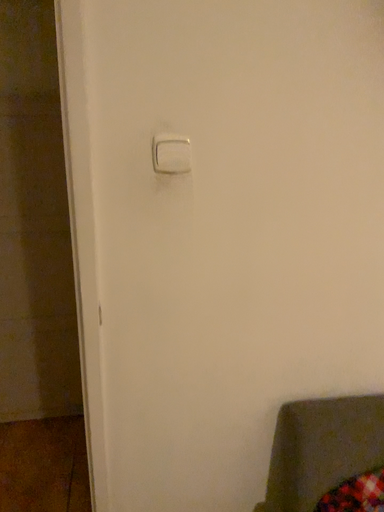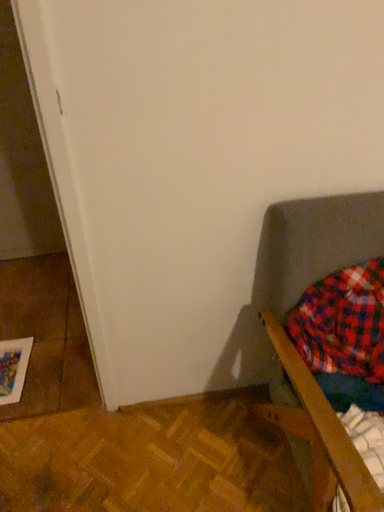
Question: How did the camera likely rotate when shooting the video?

Choices:
 (A) rotated downward
 (B) rotated upward

Answer: (A)